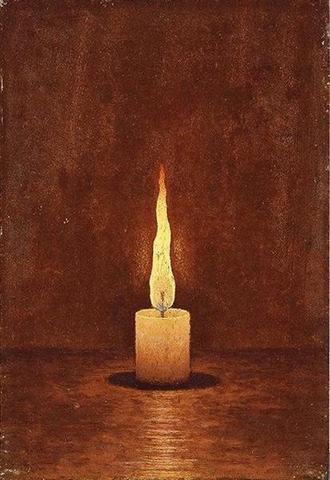
Locate an element on the screen. The image size is (330, 480). candle wick is located at coordinates (162, 313).